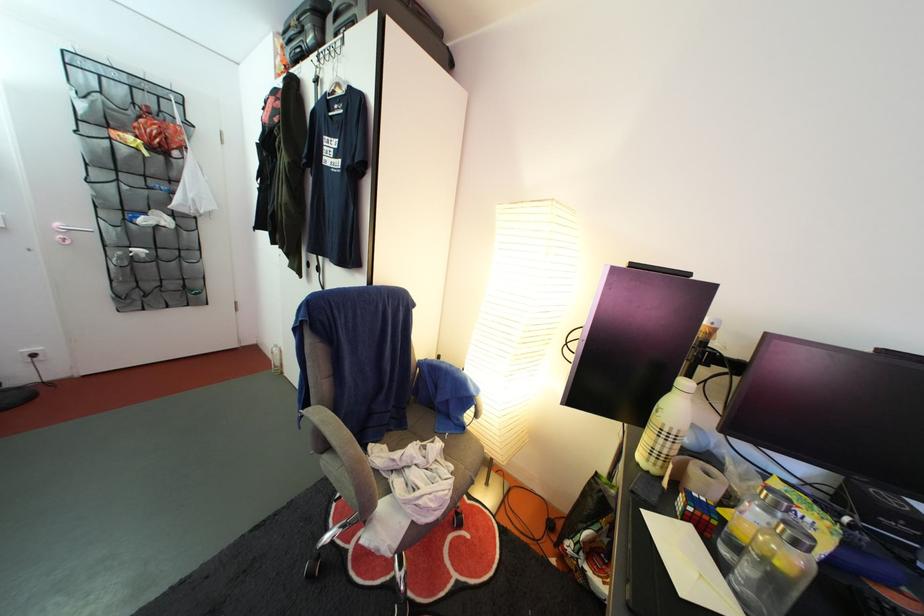
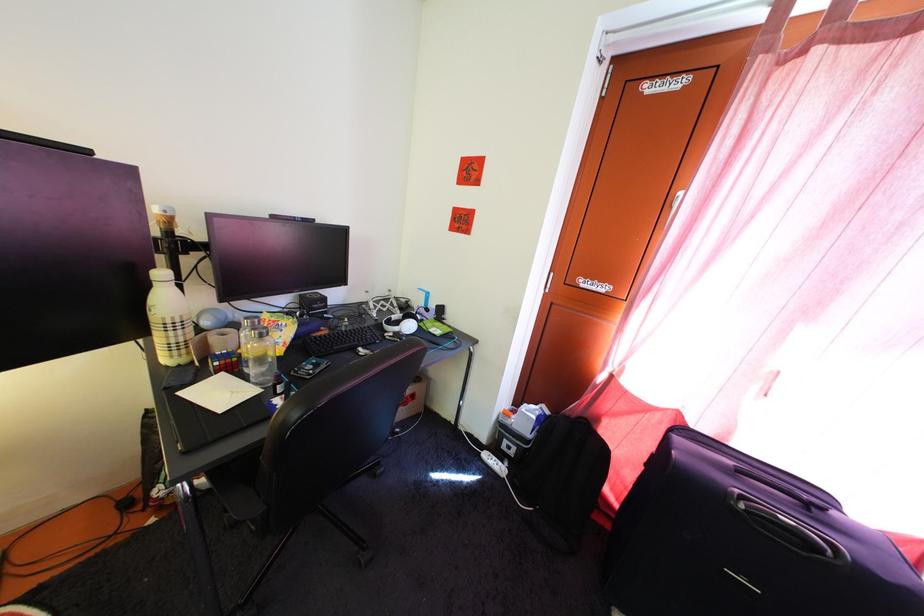
Question: I am providing you with two images of the same scene from different viewpoints. Please identify which objects are invisible in image2.

Choices:
 (A) clear drinking glass
 (B) rubik's cube toy
 (C) power strip switch
 (D) none of these

Answer: (D)